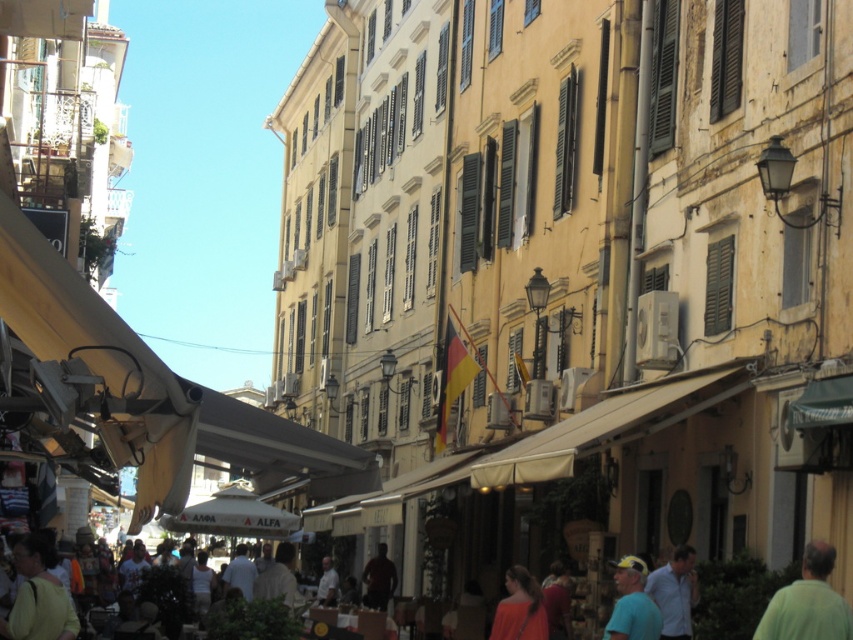
Does point (670, 624) lie behind point (619, 563)?

That is True.

Is light blue shirt at lower right wider than yellow cap at lower right?

Yes, light blue shirt at lower right is wider than yellow cap at lower right.

Measure the distance between light blue shirt at lower right and camera.

light blue shirt at lower right is 50.89 meters away from camera.

Locate an element on the screen. light blue shirt at lower right is located at coordinates (674, 593).

Which is in front, point (508, 580) or point (363, 572)?

Point (508, 580)

Is point (523, 596) in front of point (387, 573)?

Yes, it is.

Find the location of `orange fabric shirt at lower center`. orange fabric shirt at lower center is located at coordinates (519, 609).

Which is above, green matte shirt at lower right or light brown fabric bag at lower left?

light brown fabric bag at lower left

Which of these two, green matte shirt at lower right or light brown fabric bag at lower left, stands taller?

Standing taller between the two is light brown fabric bag at lower left.

This screenshot has height=640, width=853. What do you see at coordinates (807, 602) in the screenshot?
I see `green matte shirt at lower right` at bounding box center [807, 602].

The image size is (853, 640). Find the location of `green matte shirt at lower right`. green matte shirt at lower right is located at coordinates (807, 602).